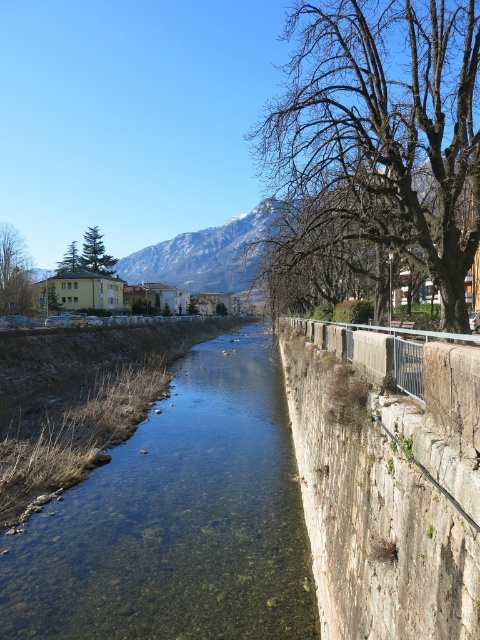
Question: Can you confirm if clear water at center is positioned below bare branches at upper right?

Choices:
 (A) no
 (B) yes

Answer: (B)

Question: Is clear water at center positioned in front of green leafy tree at left?

Choices:
 (A) yes
 (B) no

Answer: (A)

Question: Which object is closer to the camera taking this photo?

Choices:
 (A) clear water at center
 (B) green leafy tree at upper left
 (C) green leafy tree at left

Answer: (A)

Question: Is bare branches at upper right in front of green matte tree at upper left?

Choices:
 (A) no
 (B) yes

Answer: (B)

Question: Which of the following is the closest to the observer?

Choices:
 (A) (10, 260)
 (B) (103, 593)
 (C) (94, 269)

Answer: (B)

Question: Considering the real-world distances, which object is closest to the green leafy tree at left?

Choices:
 (A) clear water at center
 (B) bare branches at upper right

Answer: (A)